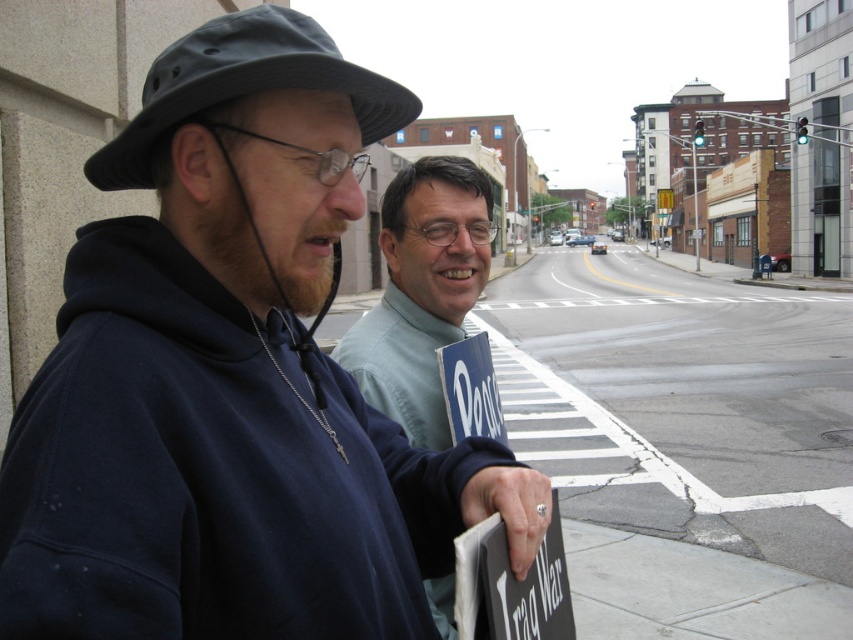
Which is behind, point (432, 376) or point (294, 52)?

Positioned behind is point (432, 376).

Who is more distant from viewer, (450, 205) or (312, 28)?

The point (450, 205) is more distant.

Identify the location of light blue shirt at center. Image resolution: width=853 pixels, height=640 pixels. (422, 291).

Is point (102, 356) behind point (354, 323)?

No, (102, 356) is closer to viewer.

Is dark blue hoodie at left below light blue shirt at center?

Correct, dark blue hoodie at left is located below light blue shirt at center.

From the picture: Measure the distance between dark blue hoodie at left and camera.

A distance of 25.56 inches exists between dark blue hoodie at left and camera.

Locate an element on the screen. This screenshot has height=640, width=853. dark blue hoodie at left is located at coordinates (231, 380).

Who is lower down, dark blue hoodie at left or dark gray fabric fedora at left?

dark blue hoodie at left is lower down.

Which of these two, dark blue hoodie at left or dark gray fabric fedora at left, stands taller?

dark blue hoodie at left is taller.

Locate an element on the screen. The image size is (853, 640). dark blue hoodie at left is located at coordinates (231, 380).

Locate an element on the screen. dark blue hoodie at left is located at coordinates (231, 380).